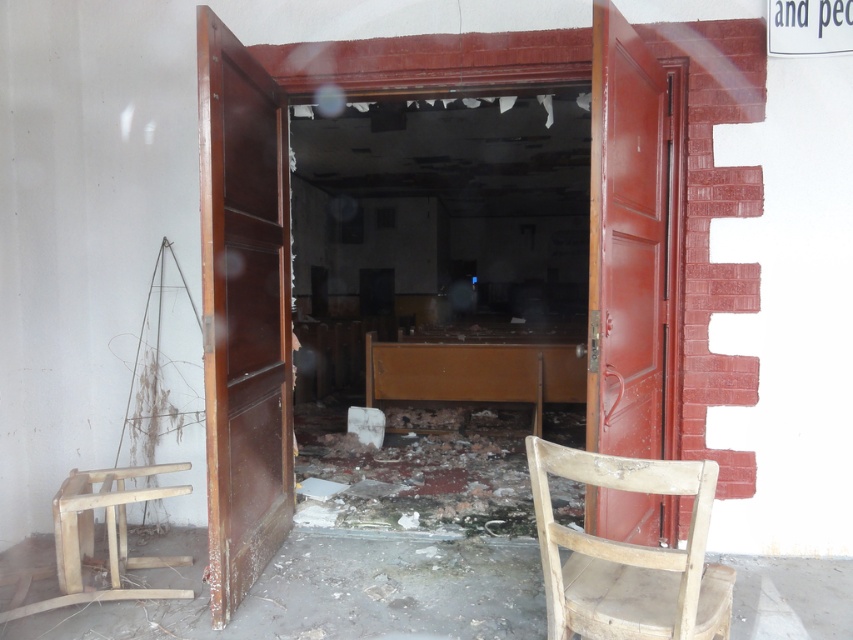
Question: Which point is farther to the camera?

Choices:
 (A) (613, 381)
 (B) (287, 244)

Answer: (B)

Question: Is mahogany wood door at center to the left of wooden chair at lower right from the viewer's perspective?

Choices:
 (A) no
 (B) yes

Answer: (B)

Question: Is smooth glossy wood door at right wider than wooden chair at lower right?

Choices:
 (A) yes
 (B) no

Answer: (B)

Question: Does mahogany wood door at center have a larger size compared to wooden stool at lower left?

Choices:
 (A) yes
 (B) no

Answer: (A)

Question: Which object appears closest to the camera in this image?

Choices:
 (A) smooth glossy wood door at right
 (B) wooden chair at lower right
 (C) mahogany wood door at center

Answer: (B)

Question: Among these objects, which one is farthest from the camera?

Choices:
 (A) mahogany wood door at center
 (B) smooth glossy wood door at right
 (C) wooden stool at lower left
 (D) wooden chair at lower right

Answer: (C)